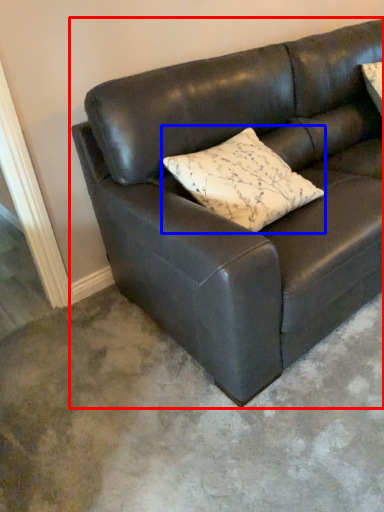
Question: Which of the following is the farthest to the observer, studio couch (highlighted by a red box) or pillow (highlighted by a blue box)?

Choices:
 (A) studio couch
 (B) pillow

Answer: (B)